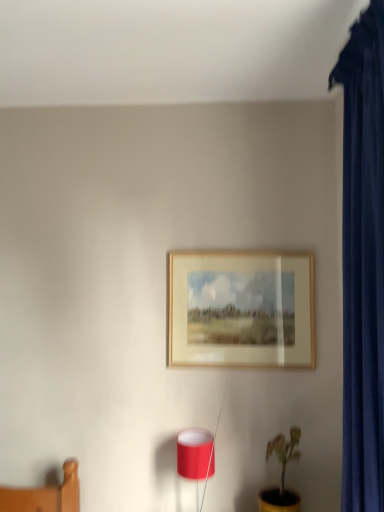
This screenshot has height=512, width=384. Describe the element at coordinates (282, 474) in the screenshot. I see `yellow matte pot at lower right` at that location.

Where is `matte red lampshade at lower center`? This screenshot has height=512, width=384. matte red lampshade at lower center is located at coordinates (195, 456).

Find the location of a particular element. The image size is (384, 512). yellow matte pot at lower right is located at coordinates (282, 474).

From the image's perspective, does wooden frame at center appear higher than yellow matte pot at lower right?

Yes.

This screenshot has width=384, height=512. I want to click on houseplant below the wooden frame at center (from the image's perspective), so click(x=282, y=474).

Is wooden frame at center next to yellow matte pot at lower right and touching it?

No, wooden frame at center is not beside yellow matte pot at lower right.

Considering the relative sizes of wooden frame at center and yellow matte pot at lower right in the image provided, is wooden frame at center wider than yellow matte pot at lower right?

Incorrect, the width of wooden frame at center does not surpass that of yellow matte pot at lower right.

Is wooden frame at center wider than matte red lampshade at lower center?

No, wooden frame at center is not wider than matte red lampshade at lower center.

From a real-world perspective, who is located lower, wooden frame at center or matte red lampshade at lower center?

In real-world perspective, matte red lampshade at lower center is lower.

Is the position of wooden frame at center less distant than that of matte red lampshade at lower center?

No, wooden frame at center is behind matte red lampshade at lower center.

Is wooden frame at center bigger or smaller than matte red lampshade at lower center?

Clearly, wooden frame at center is larger in size than matte red lampshade at lower center.

Between matte red lampshade at lower center and wooden frame at center, which one has larger size?

Bigger between the two is wooden frame at center.

Could you tell me if matte red lampshade at lower center is turned towards wooden frame at center?

No, matte red lampshade at lower center is not oriented towards wooden frame at center.

Can we say matte red lampshade at lower center lies outside wooden frame at center?

matte red lampshade at lower center lies outside wooden frame at center's area.

In the scene shown: Is matte red lampshade at lower center in contact with wooden frame at center?

matte red lampshade at lower center and wooden frame at center are not in contact.

Is yellow matte pot at lower right located within matte red lampshade at lower center?

No, yellow matte pot at lower right is located outside of matte red lampshade at lower center.

Which of these two, matte red lampshade at lower center or yellow matte pot at lower right, is wider?

With larger width is yellow matte pot at lower right.

Is matte red lampshade at lower center oriented away from yellow matte pot at lower right?

matte red lampshade at lower center is not turned away from yellow matte pot at lower right.

From a real-world perspective, is yellow matte pot at lower right on wooden frame at center?

No.

From the image's perspective, who appears lower, yellow matte pot at lower right or wooden frame at center?

yellow matte pot at lower right is shown below in the image.

The width and height of the screenshot is (384, 512). I want to click on houseplant below the wooden frame at center (from the image's perspective), so click(282, 474).

Does yellow matte pot at lower right have a greater height compared to wooden frame at center?

No, yellow matte pot at lower right is not taller than wooden frame at center.

From a real-world perspective, which object rests below the other?

From a 3D spatial view, matte red lampshade at lower center is below.

Consider the image. Is yellow matte pot at lower right inside or outside of matte red lampshade at lower center?

yellow matte pot at lower right is not enclosed by matte red lampshade at lower center.

Who is taller, yellow matte pot at lower right or matte red lampshade at lower center?

yellow matte pot at lower right is taller.

Locate an element on the screen. This screenshot has width=384, height=512. table lamp on the left of yellow matte pot at lower right is located at coordinates (195, 456).

At what (x,y) coordinates should I click in order to perform the action: click on picture frame behind the yellow matte pot at lower right. Please return your answer as a coordinate pair (x, y). The height and width of the screenshot is (512, 384). Looking at the image, I should click on (241, 309).

Find the location of a particular element. table lamp in front of the wooden frame at center is located at coordinates (195, 456).

Based on the photo, looking at the image, which one is located further to yellow matte pot at lower right, matte red lampshade at lower center or wooden frame at center?

wooden frame at center is positioned further to the anchor yellow matte pot at lower right.

Which object lies nearer to the anchor point matte red lampshade at lower center, wooden frame at center or yellow matte pot at lower right?

yellow matte pot at lower right is closer to matte red lampshade at lower center.

When comparing their distances from wooden frame at center, does yellow matte pot at lower right or matte red lampshade at lower center seem closer?

matte red lampshade at lower center is closer to wooden frame at center.

When comparing their distances from yellow matte pot at lower right, does wooden frame at center or matte red lampshade at lower center seem further?

Based on the image, wooden frame at center appears to be further to yellow matte pot at lower right.

Based on their spatial positions, is yellow matte pot at lower right or wooden frame at center further from matte red lampshade at lower center?

wooden frame at center is positioned further to the anchor matte red lampshade at lower center.

Considering their positions, is matte red lampshade at lower center positioned closer to wooden frame at center than yellow matte pot at lower right?

matte red lampshade at lower center is positioned closer to the anchor wooden frame at center.

At what (x,y) coordinates should I click in order to perform the action: click on houseplant between wooden frame at center and matte red lampshade at lower center vertically. Please return your answer as a coordinate pair (x, y). Looking at the image, I should click on (282, 474).